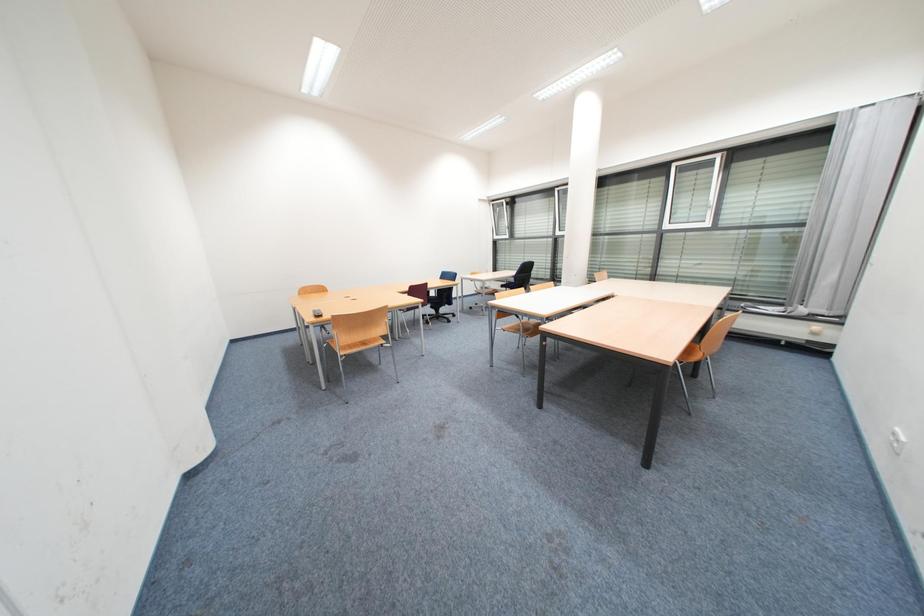
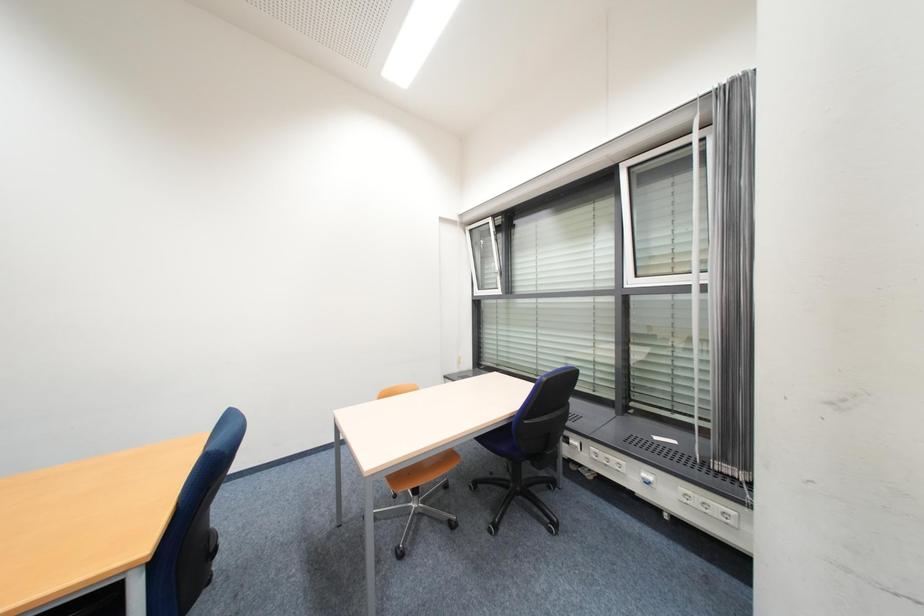
Question: Which direction would the cameraman need to move to produce the second image? Reply with the corresponding letter.

Choices:
 (A) Left
 (B) Right
 (C) Forward
 (D) Backward

Answer: (C)